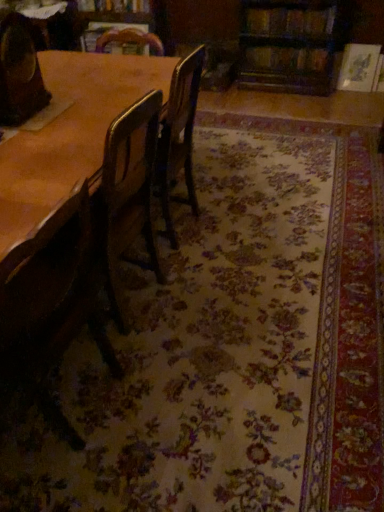
Locate an element on the screen. This screenshot has width=384, height=512. free spot above hardcover book at upper center, which is counted as the second book, starting from the right (from a real-world perspective) is located at coordinates (299, 2).